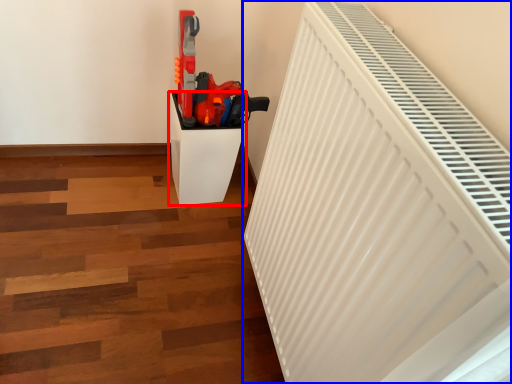
Question: Among these objects, which one is nearest to the camera, furniture (highlighted by a red box) or radiator (highlighted by a blue box)?

Choices:
 (A) furniture
 (B) radiator

Answer: (B)